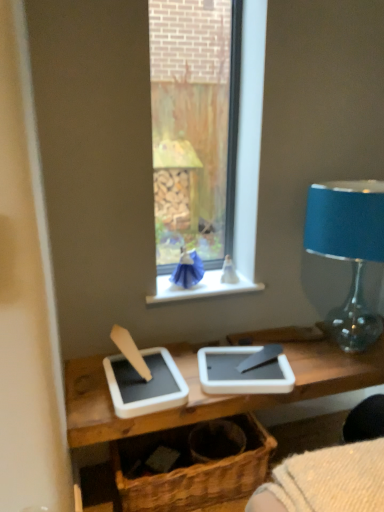
Where is `white plastic window sill at center`? The height and width of the screenshot is (512, 384). white plastic window sill at center is located at coordinates (201, 288).

In order to face blue glass lampshade at right, should I rotate leftwards or rightwards?

You should look right and rotate roughly 21.656 degrees.

Identify the location of white plastic window sill at center. The height and width of the screenshot is (512, 384). (201, 288).

Is blue glass lampshade at right taller than white plastic window sill at center?

Correct, blue glass lampshade at right is much taller as white plastic window sill at center.

Does point (383, 253) come behind point (158, 288)?

No, it is not.

How many degrees apart are the facing directions of blue glass lampshade at right and white plastic window sill at center?

3.4 degrees.

Is blue glass lampshade at right far away from white plastic window sill at center?

No, blue glass lampshade at right is in close proximity to white plastic window sill at center.

Would you say brown woven basket at center is a long distance from blue glass lampshade at right?

Absolutely, brown woven basket at center is distant from blue glass lampshade at right.

Visually, is brown woven basket at center positioned to the left or to the right of blue glass lampshade at right?

brown woven basket at center is positioned on blue glass lampshade at right's left side.

How much distance is there between brown woven basket at center and blue glass lampshade at right?

1.02 meters.

Is brown woven basket at center bigger or smaller than blue glass lampshade at right?

Considering their sizes, brown woven basket at center takes up less space than blue glass lampshade at right.

Considering the sizes of white plastic window sill at center and brown woven basket at center in the image, is white plastic window sill at center wider or thinner than brown woven basket at center?

white plastic window sill at center is thinner than brown woven basket at center.

Is white plastic window sill at center behind brown woven basket at center?

Yes, white plastic window sill at center is behind brown woven basket at center.

This screenshot has width=384, height=512. I want to click on window sill above the brown woven basket at center (from a real-world perspective), so click(201, 288).

Is white plastic window sill at center positioned with its back to brown woven basket at center?

No, white plastic window sill at center is not facing away from brown woven basket at center.

Is white plastic window sill at center bigger or smaller than blue glass lampshade at right?

In the image, white plastic window sill at center appears to be smaller than blue glass lampshade at right.

Does white plastic window sill at center have a lesser width compared to blue glass lampshade at right?

Indeed, white plastic window sill at center has a lesser width compared to blue glass lampshade at right.

From the image's perspective, who appears lower, white plastic window sill at center or blue glass lampshade at right?

white plastic window sill at center.

Does white plastic window sill at center appear on the left side of blue glass lampshade at right?

Yes.

Where is `basket lying in front of the white plastic window sill at center`? basket lying in front of the white plastic window sill at center is located at coordinates (190, 470).

Is brown woven basket at center facing away from white plastic window sill at center?

No, white plastic window sill at center is not at the back of brown woven basket at center.

Is brown woven basket at center placed right next to white plastic window sill at center?

No, brown woven basket at center is not touching white plastic window sill at center.

Looking at this image, which is behind, brown woven basket at center or white plastic window sill at center?

white plastic window sill at center is further away from the camera.

Could you tell me if blue glass lampshade at right is facing brown woven basket at center?

No.

From the image's perspective, which is below, blue glass lampshade at right or brown woven basket at center?

brown woven basket at center is shown below in the image.

Would you say blue glass lampshade at right is to the left or to the right of brown woven basket at center in the picture?

From the image, it's evident that blue glass lampshade at right is to the right of brown woven basket at center.

Are blue glass lampshade at right and brown woven basket at center beside each other?

blue glass lampshade at right is not next to brown woven basket at center, and they're not touching.

Where is `window sill lying below the blue glass lampshade at right (from the image's perspective)`? window sill lying below the blue glass lampshade at right (from the image's perspective) is located at coordinates (201, 288).

The width and height of the screenshot is (384, 512). Find the location of `lamp that appears in front of the brown woven basket at center`. lamp that appears in front of the brown woven basket at center is located at coordinates (348, 250).

Looking at the image, which one is located further to white plastic window sill at center, blue glass lampshade at right or brown woven basket at center?

brown woven basket at center is further to white plastic window sill at center.

Looking at the image, which one is located further to brown woven basket at center, blue glass lampshade at right or white plastic window sill at center?

blue glass lampshade at right.

When comparing their distances from blue glass lampshade at right, does brown woven basket at center or white plastic window sill at center seem further?

brown woven basket at center is further to blue glass lampshade at right.

Looking at the image, which one is located closer to brown woven basket at center, white plastic window sill at center or blue glass lampshade at right?

Based on the image, white plastic window sill at center appears to be nearer to brown woven basket at center.

Which object lies further to the anchor point white plastic window sill at center, brown woven basket at center or blue glass lampshade at right?

brown woven basket at center is further to white plastic window sill at center.

From the image, which object appears to be nearer to blue glass lampshade at right, white plastic window sill at center or brown woven basket at center?

Among the two, white plastic window sill at center is located nearer to blue glass lampshade at right.

Where is `window sill between blue glass lampshade at right and brown woven basket at center in the up-down direction`? window sill between blue glass lampshade at right and brown woven basket at center in the up-down direction is located at coordinates (201, 288).